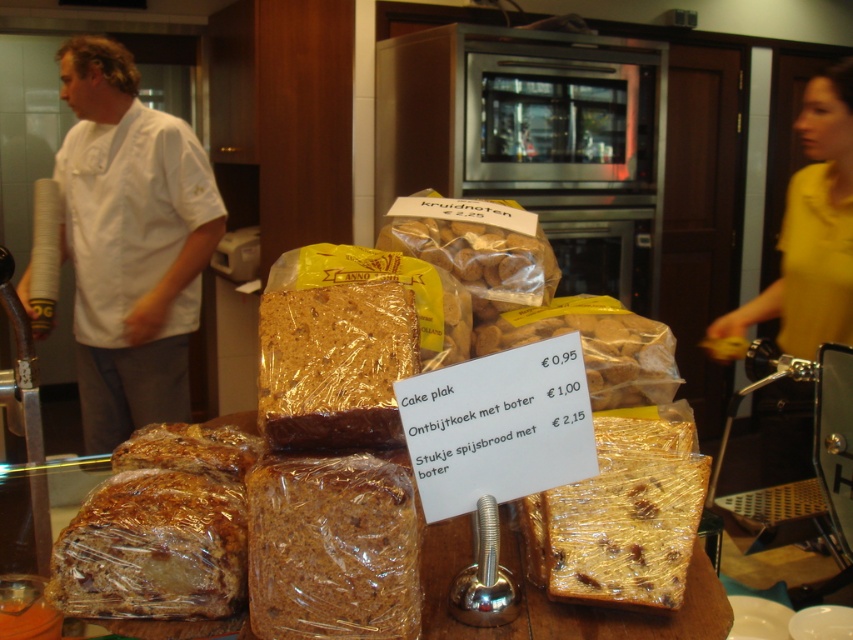
From the picture: Who is positioned more to the left, translucent plastic cake at center or translucent plastic bread at center?

translucent plastic bread at center is more to the left.

Does translucent plastic cake at center have a smaller size compared to translucent plastic bread at center?

Yes.

Locate an element on the screen. Image resolution: width=853 pixels, height=640 pixels. translucent plastic cake at center is located at coordinates (622, 515).

In the scene shown: Is white chef coat at left in front of translucent plastic cake at center?

No, white chef coat at left is behind translucent plastic cake at center.

Does point (97, 333) come behind point (679, 497)?

Yes, point (97, 333) is behind point (679, 497).

Identify the location of white chef coat at left. This screenshot has width=853, height=640. (131, 241).

Does translucent plastic cake at center have a smaller size compared to yellow fabric shirt at right?

Indeed, translucent plastic cake at center has a smaller size compared to yellow fabric shirt at right.

What do you see at coordinates (622, 515) in the screenshot? Image resolution: width=853 pixels, height=640 pixels. I see `translucent plastic cake at center` at bounding box center [622, 515].

The width and height of the screenshot is (853, 640). What do you see at coordinates (622, 515) in the screenshot?
I see `translucent plastic cake at center` at bounding box center [622, 515].

Identify the location of translucent plastic cake at center. (622, 515).